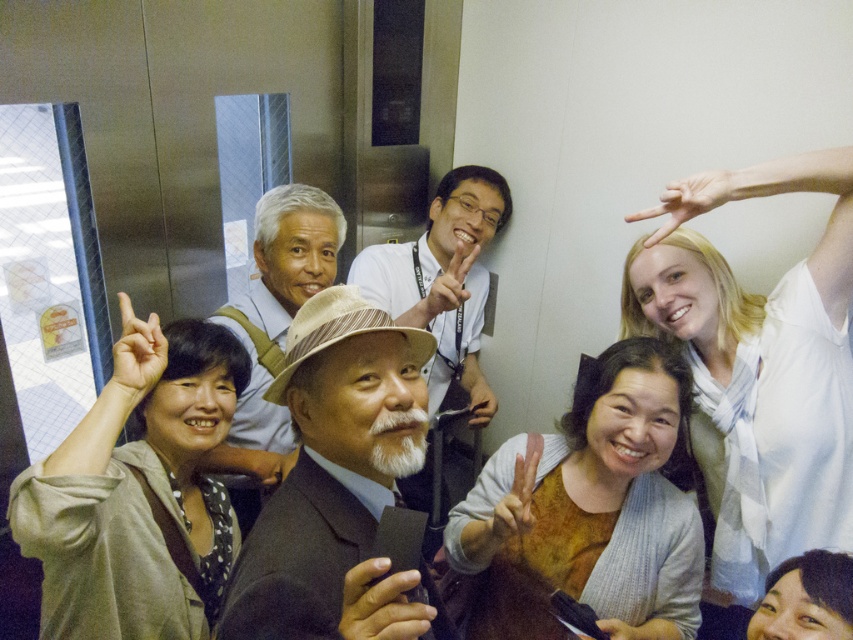
You are standing in the elevator and want to touch the light brown fabric hat at center. The point you need to reach is at coordinate point (343, 460). Is this point located on the light brown fabric hat at center?

Yes, the point (343, 460) is located on the light brown fabric hat at center according to the description.

You are standing in the elevator and want to take a photo of the light brown fabric hat at center and the white beard at center. Based on their positions, which one is closer to the camera?

The light brown fabric hat at center is below the white beard at center, so the white beard at center is closer to the camera.